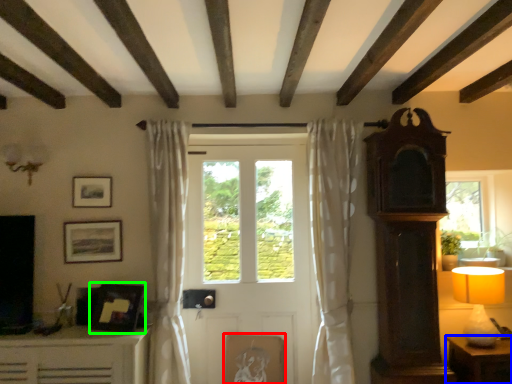
Question: Based on their relative distances, which object is farther from picture frame (highlighted by a red box)? Choose from table (highlighted by a blue box) and picture frame (highlighted by a green box).

Choices:
 (A) table
 (B) picture frame

Answer: (A)